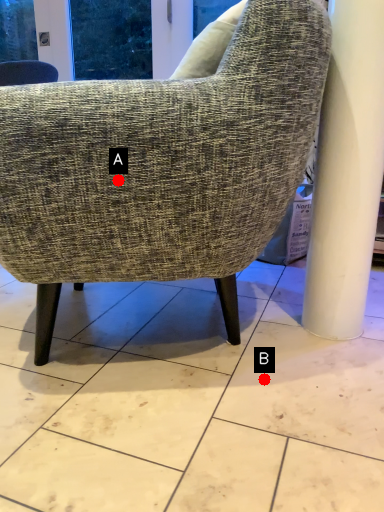
Question: Two points are circled on the image, labeled by A and B beside each circle. Which point is farther from the camera taking this photo?

Choices:
 (A) A is further
 (B) B is further

Answer: (B)